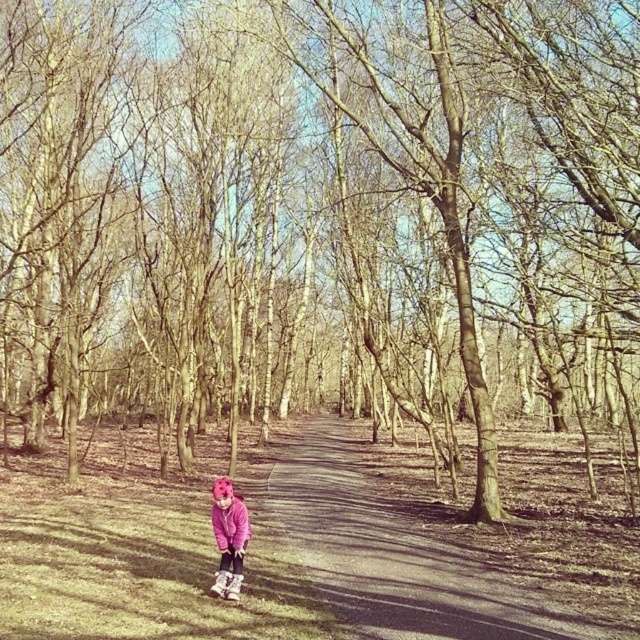
Can you confirm if brown dirt path at center is positioned to the left of pink fleece sweatshirt at center?

In fact, brown dirt path at center is to the right of pink fleece sweatshirt at center.

From the picture: Between brown dirt path at center and pink fleece sweatshirt at center, which one is positioned lower?

brown dirt path at center is lower down.

Identify the location of brown dirt path at center. (417, 552).